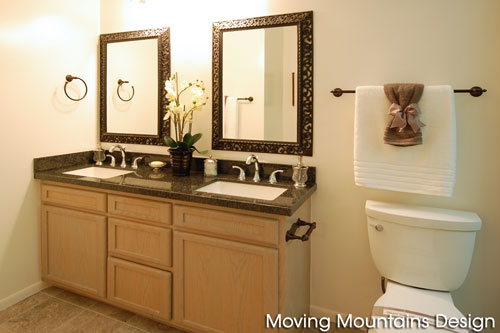
Where is `gold frames for mirrors`? gold frames for mirrors is located at coordinates (167, 49), (214, 55).